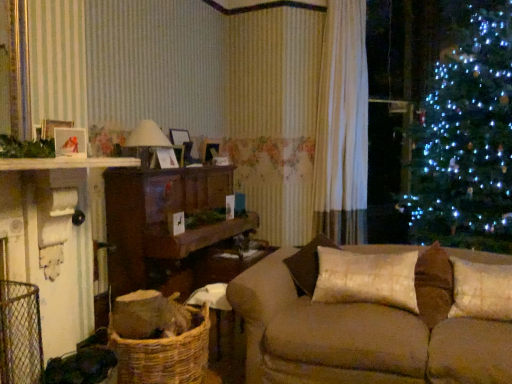
The image size is (512, 384). What are the coordinates of `matte white picture frame at left` in the screenshot? It's located at click(70, 142).

The width and height of the screenshot is (512, 384). Find the location of `white sheer curtain at center`. white sheer curtain at center is located at coordinates (342, 126).

Image resolution: width=512 pixels, height=384 pixels. What do you see at coordinates (342, 126) in the screenshot? I see `white sheer curtain at center` at bounding box center [342, 126].

Find the location of `wooden cabinet at center`. wooden cabinet at center is located at coordinates (166, 224).

What do you see at coordinates (164, 356) in the screenshot? I see `woven brown basket at lower left` at bounding box center [164, 356].

Locate an element on the screen. matte white picture frame at left is located at coordinates (70, 142).

Is point (445, 271) positioned behind point (179, 263)?

That is False.

Is brown fabric couch at center facing towards wooden cabinet at center?

No, brown fabric couch at center is not facing towards wooden cabinet at center.

In the image, is brown fabric couch at center positioned in front of or behind wooden cabinet at center?

brown fabric couch at center is positioned closer to the viewer than wooden cabinet at center.

Which is behind, point (159, 253) or point (70, 146)?

The point (159, 253) is more distant.

Is wooden cabinet at center smaller than matte white picture frame at left?

Actually, wooden cabinet at center might be larger than matte white picture frame at left.

Is wooden cabinet at center oriented away from matte white picture frame at left?

wooden cabinet at center does not have its back to matte white picture frame at left.

At what (x,y) coordinates should I click in order to perform the action: click on entertainment center located behind the satin beige pillow at center, the second pillow from the right. Please return your answer as a coordinate pair (x, y). Looking at the image, I should click on (166, 224).

Consider the image. Are wooden cabinet at center and satin beige pillow at center, which ranks as the 1th pillow in left-to-right order, far apart?

Absolutely, wooden cabinet at center is distant from satin beige pillow at center, which ranks as the 1th pillow in left-to-right order.

Which object is further away from the camera, wooden cabinet at center or satin beige pillow at center, the second pillow from the right?

wooden cabinet at center is more distant.

From the image's perspective, which one is positioned higher, wooden cabinet at center or satin beige pillow at center, which ranks as the 1th pillow in left-to-right order?

wooden cabinet at center.

Would you say white textured pillow at right, the first pillow viewed from the right, is outside matte white picture frame at left?

Indeed, white textured pillow at right, the first pillow viewed from the right, is completely outside matte white picture frame at left.

Can you tell me how much white textured pillow at right, the first pillow viewed from the right, and matte white picture frame at left differ in facing direction?

The angle between the facing direction of white textured pillow at right, the first pillow viewed from the right, and the facing direction of matte white picture frame at left is 63.3 degrees.

Considering the positions of objects white textured pillow at right, the first pillow viewed from the right, and matte white picture frame at left in the image provided, who is more to the right, white textured pillow at right, the first pillow viewed from the right, or matte white picture frame at left?

white textured pillow at right, the first pillow viewed from the right.

From a real-world perspective, relative to matte white picture frame at left, is white textured pillow at right, positioned as the 2th pillow in left-to-right order, vertically above or below?

Clearly, from a real-world perspective, white textured pillow at right, positioned as the 2th pillow in left-to-right order, is below matte white picture frame at left.

The image size is (512, 384). I want to click on picture frame below the matte white lampshade at center (from the image's perspective), so click(x=70, y=142).

Between matte white lampshade at center and matte white picture frame at left, which one is positioned in front?

matte white picture frame at left is in front.

What's the angular difference between matte white lampshade at center and matte white picture frame at left's facing directions?

The angle between the facing direction of matte white lampshade at center and the facing direction of matte white picture frame at left is 28 degrees.

Looking at the image, does matte white lampshade at center seem bigger or smaller compared to matte white picture frame at left?

matte white lampshade at center is bigger than matte white picture frame at left.

Which is in front, woven brown basket at lower left or satin beige pillow at center, which ranks as the 1th pillow in left-to-right order?

woven brown basket at lower left.

Which of these two, woven brown basket at lower left or satin beige pillow at center, the second pillow from the right, is thinner?

Thinner between the two is satin beige pillow at center, the second pillow from the right.

In terms of size, does woven brown basket at lower left appear bigger or smaller than satin beige pillow at center, which ranks as the 1th pillow in left-to-right order?

Clearly, woven brown basket at lower left is larger in size than satin beige pillow at center, which ranks as the 1th pillow in left-to-right order.

Considering the points (194, 378) and (365, 107), which point is in front, point (194, 378) or point (365, 107)?

Point (194, 378)

Is woven brown basket at lower left spatially inside white sheer curtain at center, or outside of it?

woven brown basket at lower left is not inside white sheer curtain at center, it's outside.

Which object is more forward, woven brown basket at lower left or white sheer curtain at center?

woven brown basket at lower left.

Would you say woven brown basket at lower left is a long distance from white sheer curtain at center?

Absolutely, woven brown basket at lower left is distant from white sheer curtain at center.

Where is `studio couch on the right of the wooden cabinet at center`? This screenshot has width=512, height=384. studio couch on the right of the wooden cabinet at center is located at coordinates (366, 332).

Where is `picture frame that appears on the left of wooden cabinet at center`? picture frame that appears on the left of wooden cabinet at center is located at coordinates click(x=70, y=142).

From the picture: From the image, which object appears to be nearer to white sheer curtain at center, matte white picture frame at left or wooden cabinet at center?

wooden cabinet at center is positioned closer to the anchor white sheer curtain at center.

Which object lies further to the anchor point white textured pillow at right, the first pillow viewed from the right, matte white lampshade at center or woven brown basket at lower left?

Among the two, matte white lampshade at center is located further to white textured pillow at right, the first pillow viewed from the right.

From the image, which object appears to be nearer to matte white picture frame at left, white textured pillow at right, positioned as the 2th pillow in left-to-right order, or matte white lampshade at center?

matte white lampshade at center.

Which object lies nearer to the anchor point brown fabric couch at center, woven brown basket at lower left or white sheer curtain at center?

woven brown basket at lower left is positioned closer to the anchor brown fabric couch at center.

From the image, which object appears to be nearer to matte white lampshade at center, wooden cabinet at center or white sheer curtain at center?

Among the two, wooden cabinet at center is located nearer to matte white lampshade at center.

Consider the image. Based on their spatial positions, is white textured pillow at right, the first pillow viewed from the right, or matte white lampshade at center further from wooden cabinet at center?

white textured pillow at right, the first pillow viewed from the right, is further to wooden cabinet at center.

Which object lies further to the anchor point white sheer curtain at center, matte white lampshade at center or white textured pillow at right, positioned as the 2th pillow in left-to-right order?

white textured pillow at right, positioned as the 2th pillow in left-to-right order, lies further to white sheer curtain at center than the other object.

Based on their spatial positions, is woven brown basket at lower left or matte white lampshade at center closer to white sheer curtain at center?

matte white lampshade at center is closer to white sheer curtain at center.

Where is `pillow between matte white lampshade at center and brown fabric couch at center in the horizontal direction`? pillow between matte white lampshade at center and brown fabric couch at center in the horizontal direction is located at coordinates (366, 278).

Locate an element on the screen. The width and height of the screenshot is (512, 384). basket between matte white picture frame at left and white textured pillow at right, the first pillow viewed from the right is located at coordinates (164, 356).

Where is `picture frame located between brown fabric couch at center and white sheer curtain at center in the depth direction`? The height and width of the screenshot is (384, 512). picture frame located between brown fabric couch at center and white sheer curtain at center in the depth direction is located at coordinates (70, 142).

This screenshot has height=384, width=512. I want to click on basket between matte white lampshade at center and white textured pillow at right, positioned as the 2th pillow in left-to-right order, so click(164, 356).